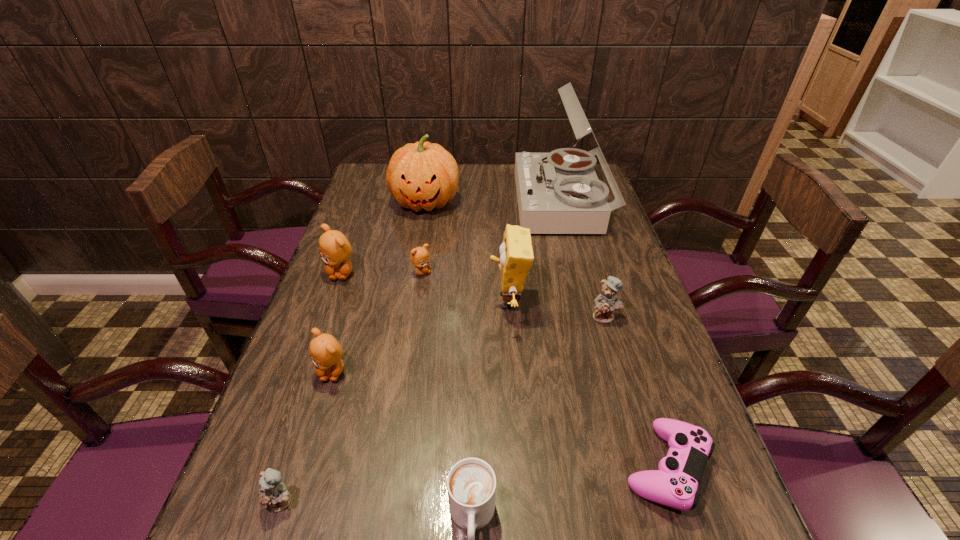
Where is `the nearest brown teddy bear`? This screenshot has width=960, height=540. the nearest brown teddy bear is located at coordinates (325, 351).

Locate an element on the screen. The height and width of the screenshot is (540, 960). the smallest brown teddy bear is located at coordinates (419, 256).

Find the location of `the fourth teddy bear from left to right`. the fourth teddy bear from left to right is located at coordinates (419, 256).

This screenshot has height=540, width=960. In order to click on the smaller blue teddy bear in this screenshot , I will do `click(273, 493)`.

Find the location of a particular element. the nearest teddy bear is located at coordinates (273, 493).

The width and height of the screenshot is (960, 540). I want to click on the shortest object, so 675,484.

Locate an element on the screen. pink control is located at coordinates (675, 484).

Image resolution: width=960 pixels, height=540 pixels. What are the coordinates of `free location located on the left of the record player` in the screenshot? It's located at (416, 203).

The height and width of the screenshot is (540, 960). I want to click on blank area located 0.240m on the carved face of the pumpkin, so click(x=414, y=270).

The image size is (960, 540). Identify the location of vacant region located on the face of the eighth shortest object. (384, 301).